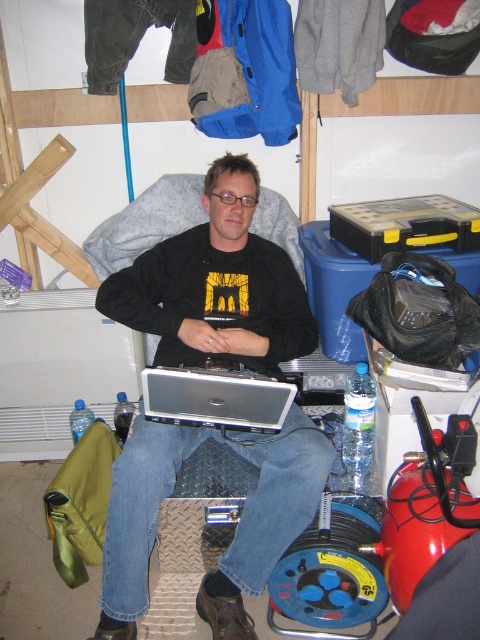
Looking at this image, can you confirm if black matte laptop at center is positioned below silver metallic laptop at center?

Actually, black matte laptop at center is above silver metallic laptop at center.

In the scene shown: Is black matte laptop at center wider than silver metallic laptop at center?

Yes, black matte laptop at center is wider than silver metallic laptop at center.

What are the coordinates of `black matte laptop at center` in the screenshot? It's located at (216, 285).